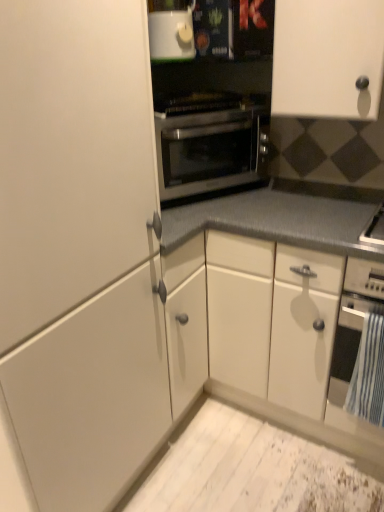
Question: Visually, is black matte oven at lower right, arranged as the second oven when viewed from the top, positioned to the left or to the right of white glossy microwave at upper center?

Choices:
 (A) left
 (B) right

Answer: (B)

Question: From a real-world perspective, relative to white glossy microwave at upper center, is black matte oven at lower right, arranged as the 1th oven when ordered from the bottom, vertically above or below?

Choices:
 (A) below
 (B) above

Answer: (A)

Question: Estimate the real-world distances between objects in this image. Which object is closer to the white matte cabinet at upper right, marked as the 1th cabinetry in a right-to-left arrangement?

Choices:
 (A) black matte oven at lower right, arranged as the second oven when viewed from the top
 (B) stainless steel oven at center, marked as the 2th oven in a bottom-to-top arrangement
 (C) white matte cabinet at left, the first cabinetry in the left-to-right sequence
 (D) white glossy microwave at upper center

Answer: (B)

Question: Estimate the real-world distances between objects in this image. Which object is closer to the white matte cabinet at upper right, which appears as the 2th cabinetry when viewed from the left?

Choices:
 (A) stainless steel oven at center, marked as the 2th oven in a bottom-to-top arrangement
 (B) black matte oven at lower right, arranged as the first oven when viewed from the right
 (C) white matte cabinet at left, the 2th cabinetry positioned from the right
 (D) white glossy microwave at upper center

Answer: (A)